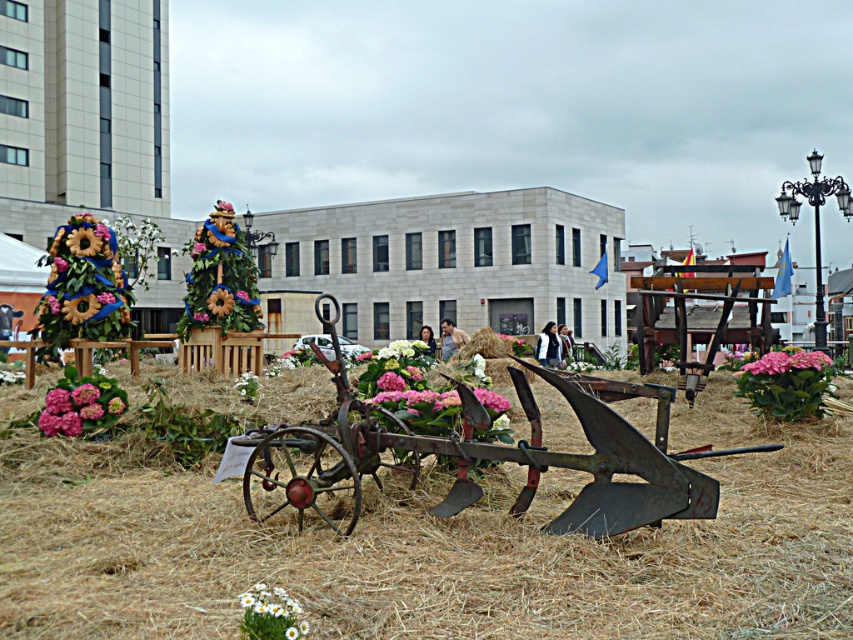
You are standing in the festival area and see the brown straw at center and the pink matte hydrangea at center right. Which object is nearer to you?

The brown straw at center is closer to the viewer than the pink matte hydrangea at center right.

You are a gardener who needs to move a watering can from the rusty metal wagon at center to the white matte flower at lower left. Considering the distance between them, can you walk directly between them without needing to go around any obstacles?

The distance between the rusty metal wagon at center and the white matte flower at lower left is 3.13 meters. Since there are no obstacles mentioned in the scene description, you can walk directly between them.